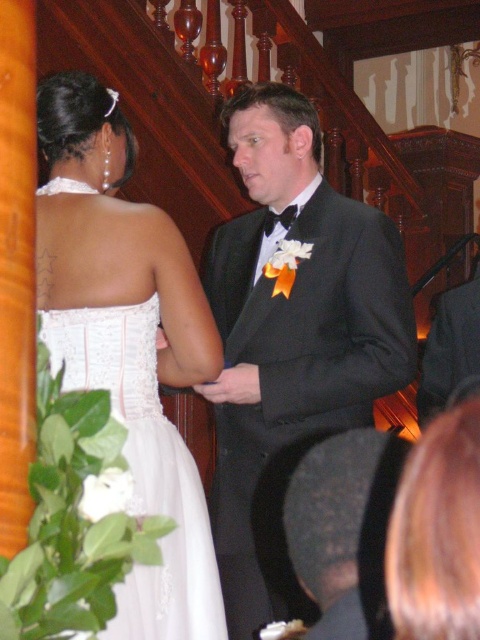
Question: Is the position of black satin tuxedo at center less distant than that of white satin dress at center?

Choices:
 (A) yes
 (B) no

Answer: (B)

Question: Which point is farther to the camera?

Choices:
 (A) pyautogui.click(x=360, y=328)
 (B) pyautogui.click(x=83, y=362)

Answer: (A)

Question: Is black satin tuxedo at center below white satin dress at center?

Choices:
 (A) yes
 (B) no

Answer: (A)

Question: Among these points, which one is farthest from the camera?

Choices:
 (A) (82, 77)
 (B) (252, 396)

Answer: (B)

Question: From the image, what is the correct spatial relationship of black satin tuxedo at center in relation to white satin dress at center?

Choices:
 (A) left
 (B) right

Answer: (B)